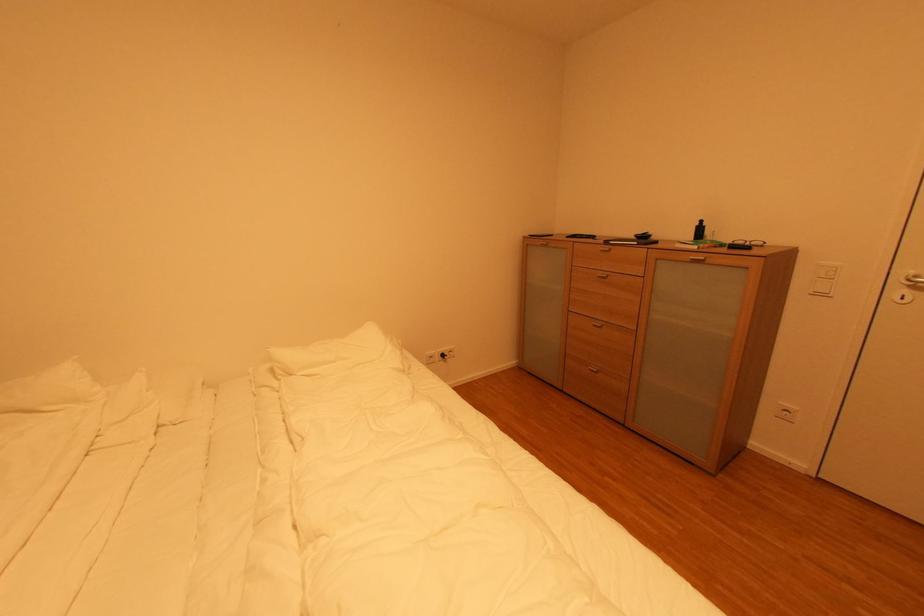
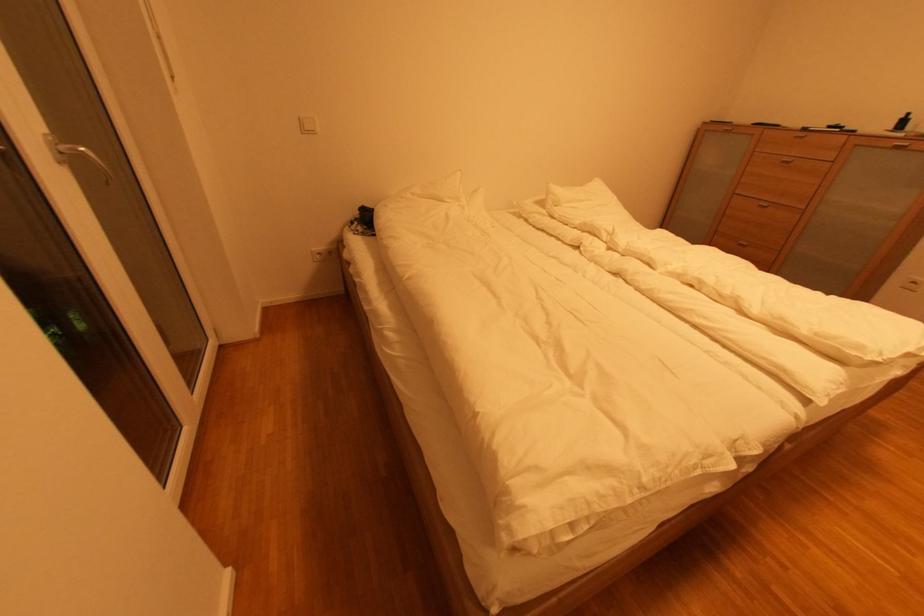
Where in the second image is the point corresponding to point (702, 225) from the first image?

(908, 118)